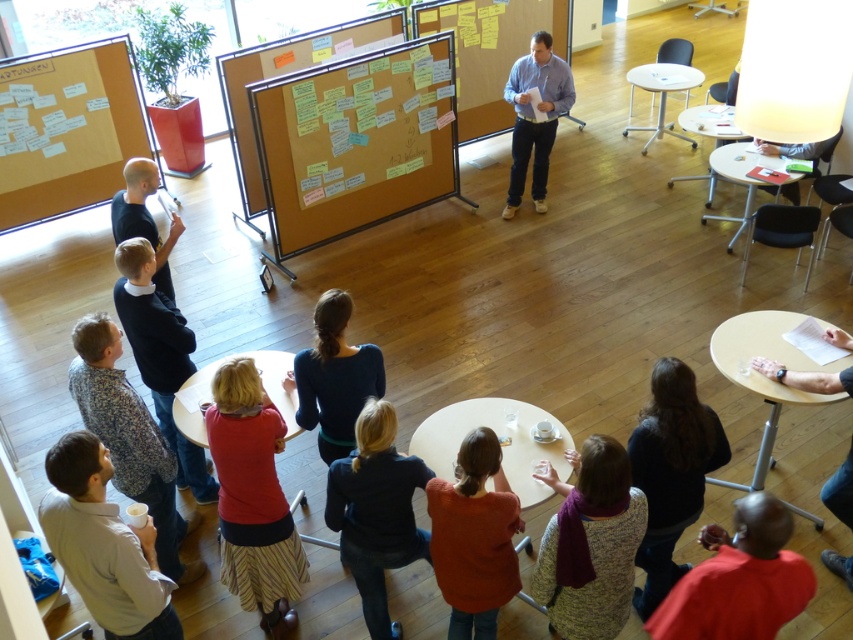
Does orange sweater at lower center appear under blue shirt at center?

Correct, orange sweater at lower center is located below blue shirt at center.

Does orange sweater at lower center appear over blue shirt at center?

No.

Does point (459, 461) come closer to viewer compared to point (521, 68)?

Yes, point (459, 461) is closer to viewer.

Find the location of a particular element. The width and height of the screenshot is (853, 640). orange sweater at lower center is located at coordinates (474, 538).

Who is higher up, dark blue sweater at center or blue shirt at center?

Positioned higher is blue shirt at center.

Consider the image. Does dark blue sweater at center appear over blue shirt at center?

No.

Is point (407, 502) closer to viewer compared to point (521, 56)?

Yes, point (407, 502) is in front of point (521, 56).

Locate an element on the screen. This screenshot has width=853, height=640. dark blue sweater at center is located at coordinates (376, 512).

Which is above, orange sweater at lower center or white glossy table at upper right?

white glossy table at upper right

Does orange sweater at lower center appear over white glossy table at upper right?

Actually, orange sweater at lower center is below white glossy table at upper right.

In order to click on orange sweater at lower center in this screenshot , I will do `click(474, 538)`.